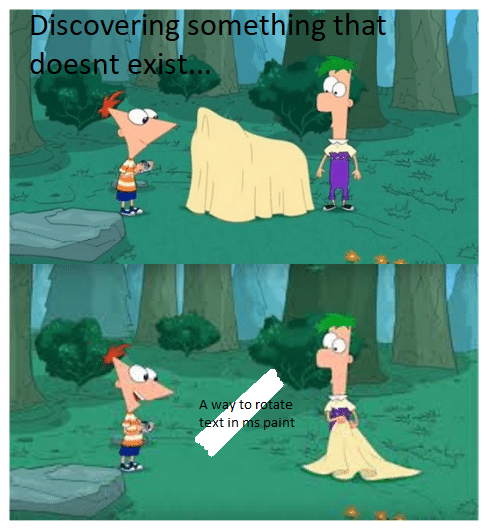
This screenshot has width=500, height=532. In order to click on blanket in ferb's hands in this screenshot , I will do `click(342, 436)`.